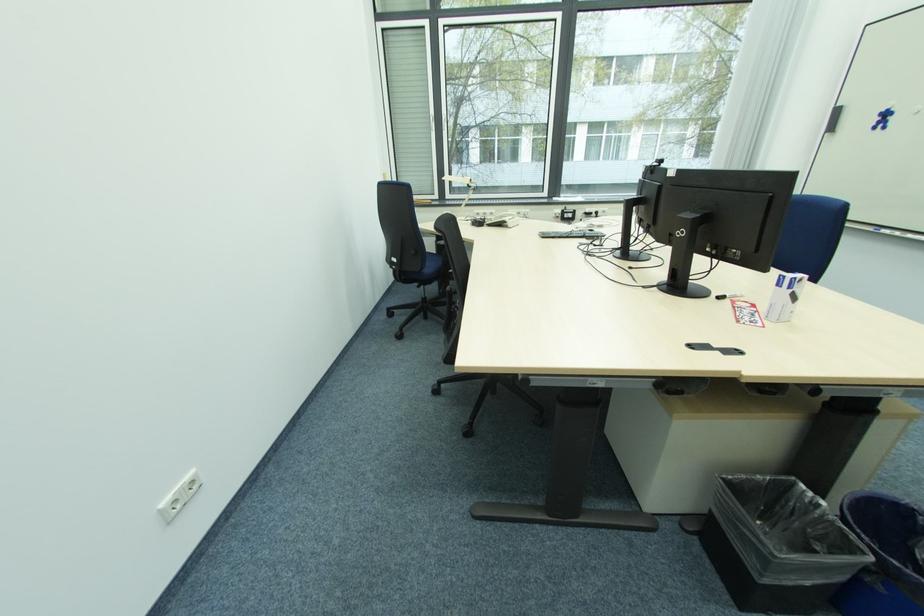
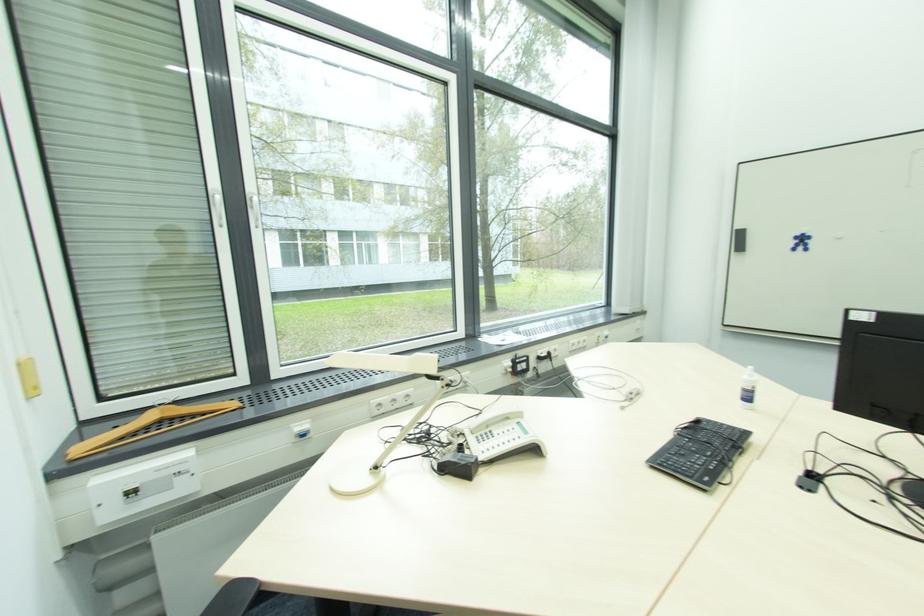
Find the pixel in the second image that matches the point at 881,121 in the first image.

(801, 244)